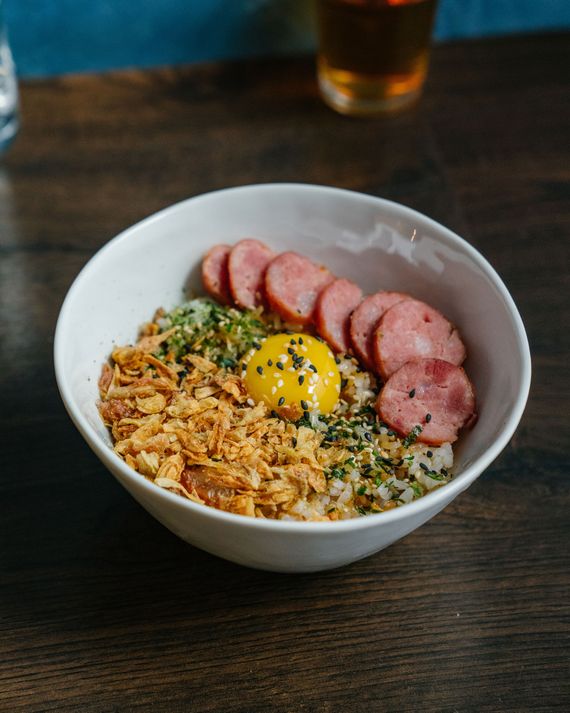
Locate an element on the screen. bowl is located at coordinates (500, 326).